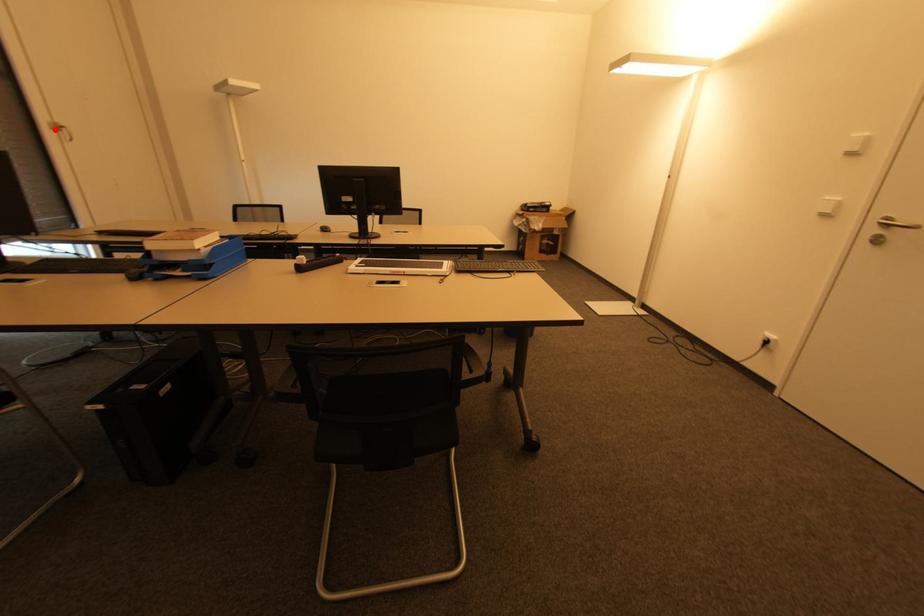
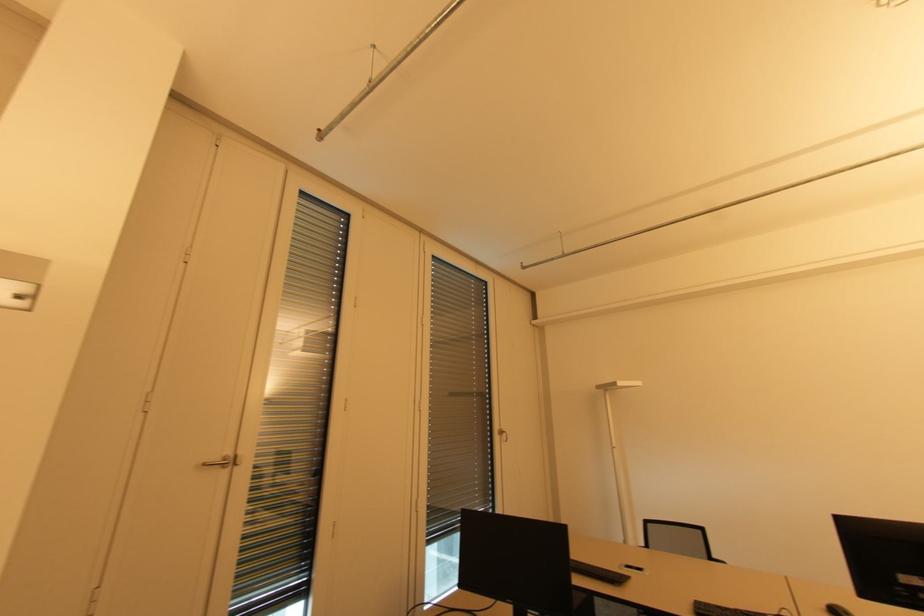
Question: I am providing you with two images of the same scene from different viewpoints. In image1, a red point is highlighted. Considering the same 3D point in image2, which of the following is correct?

Choices:
 (A) It is closer
 (B) It is farther

Answer: (A)